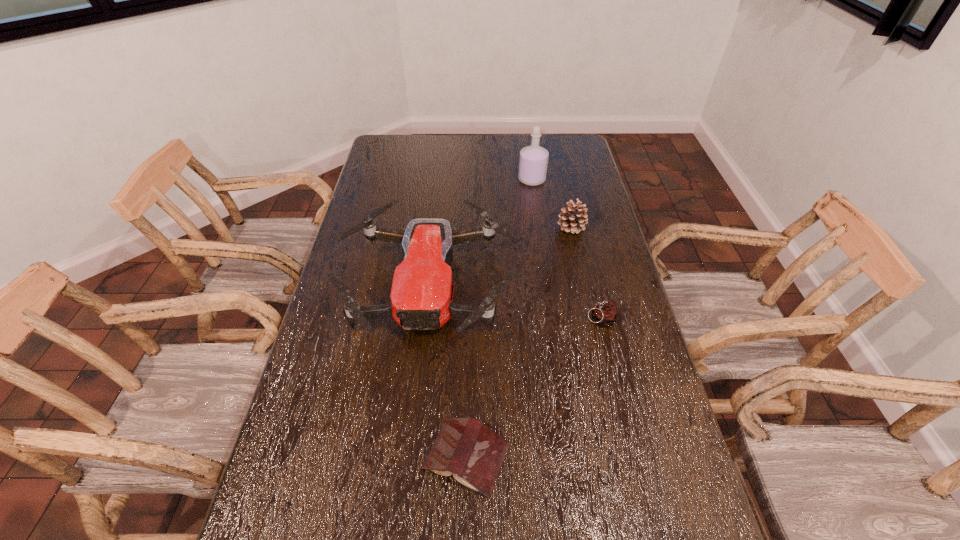
I want to click on vacant area that lies between the shortest object and the taller pinecone, so click(518, 342).

This screenshot has width=960, height=540. I want to click on free area in between the drone and the shorter pinecone, so click(x=514, y=304).

Where is `free spot between the nearer pinecone and the drone`? free spot between the nearer pinecone and the drone is located at coordinates (514, 304).

Image resolution: width=960 pixels, height=540 pixels. What are the coordinates of `vacant space in between the shorter pinecone and the drone` in the screenshot? It's located at (514, 304).

This screenshot has width=960, height=540. In order to click on blank region between the farthest object and the fourth tallest object in this screenshot , I will do `click(565, 249)`.

At what (x,y) coordinates should I click in order to perform the action: click on free space between the second shortest object and the drone. Please return your answer as a coordinate pair (x, y). This screenshot has height=540, width=960. Looking at the image, I should click on (514, 304).

Locate an element on the screen. empty space that is in between the second tallest object and the shortest object is located at coordinates (447, 373).

Find the location of `the fourth closest object to the third shortest object`. the fourth closest object to the third shortest object is located at coordinates (466, 447).

Point out which object is positioned as the fourth nearest to the nearer pinecone. Please provide its 2D coordinates. Your answer should be formatted as a tuple, i.e. [(x, y)], where the tuple contains the x and y coordinates of a point satisfying the conditions above.

[(533, 162)]

Find the location of a particular element. free spot that satisfies the following two spatial constraints: 1. on the front side of the farther pinecone; 2. on the left side of the farthest object is located at coordinates [x=539, y=227].